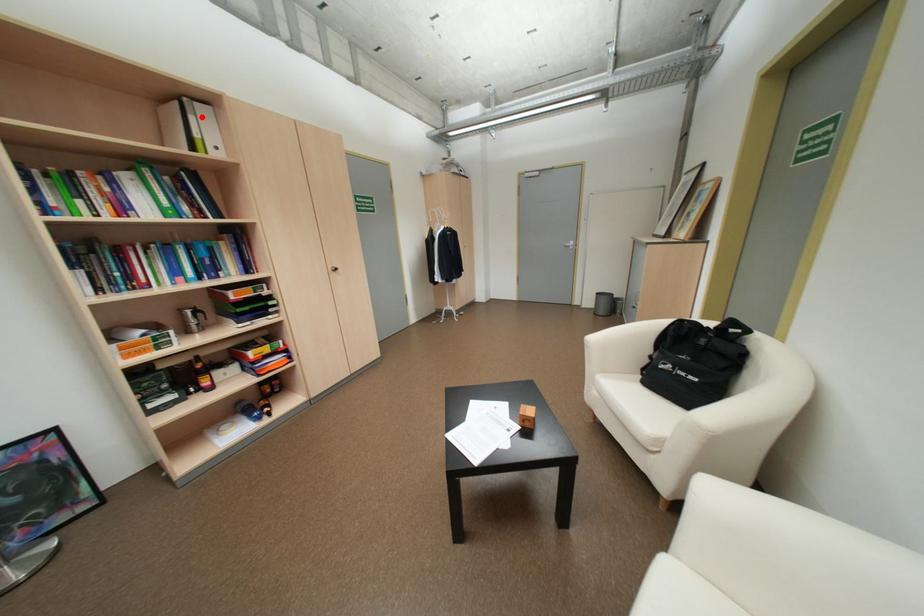
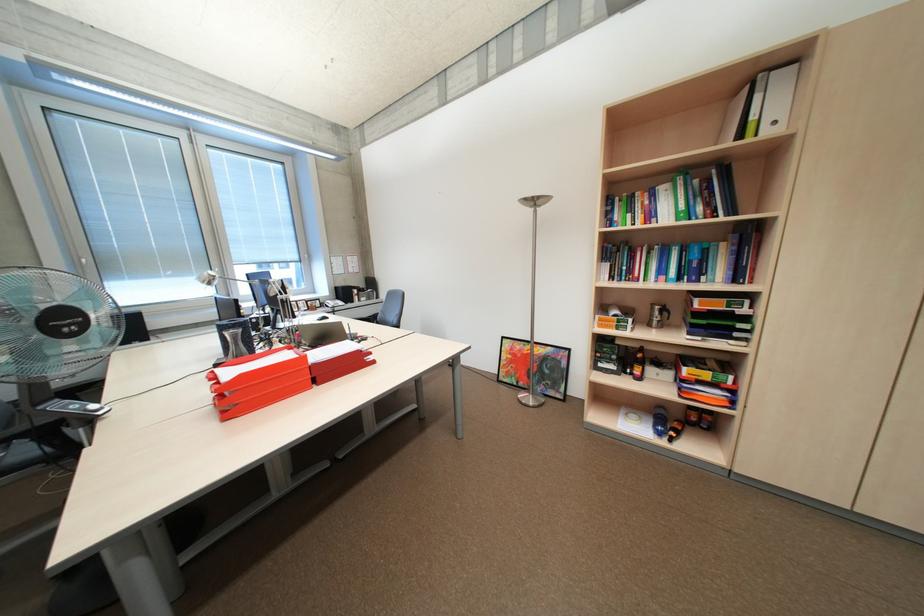
Find the pixel in the second image that matches the highlighted location in the first image.

(768, 97)